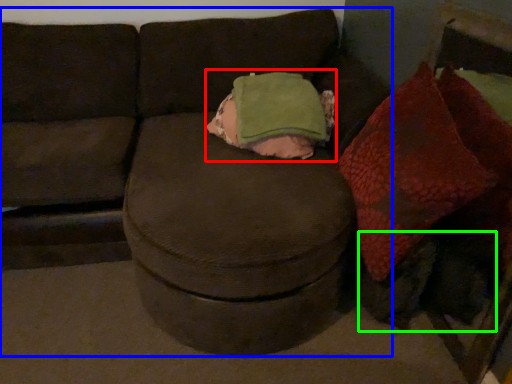
Question: Considering the real-world distances, which object is farthest from throw pillow (highlighted by a red box)? studio couch (highlighted by a blue box) or animal (highlighted by a green box)?

Choices:
 (A) studio couch
 (B) animal

Answer: (B)